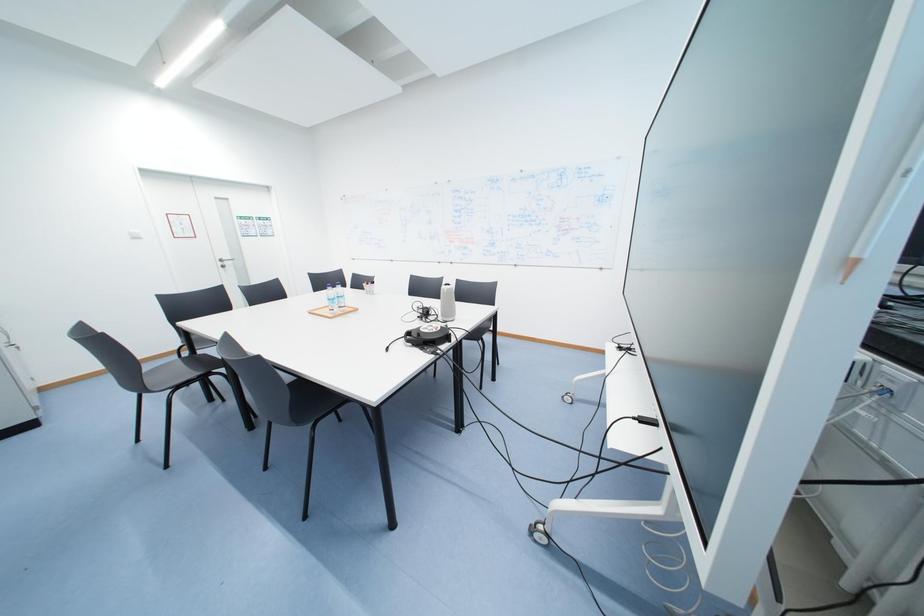
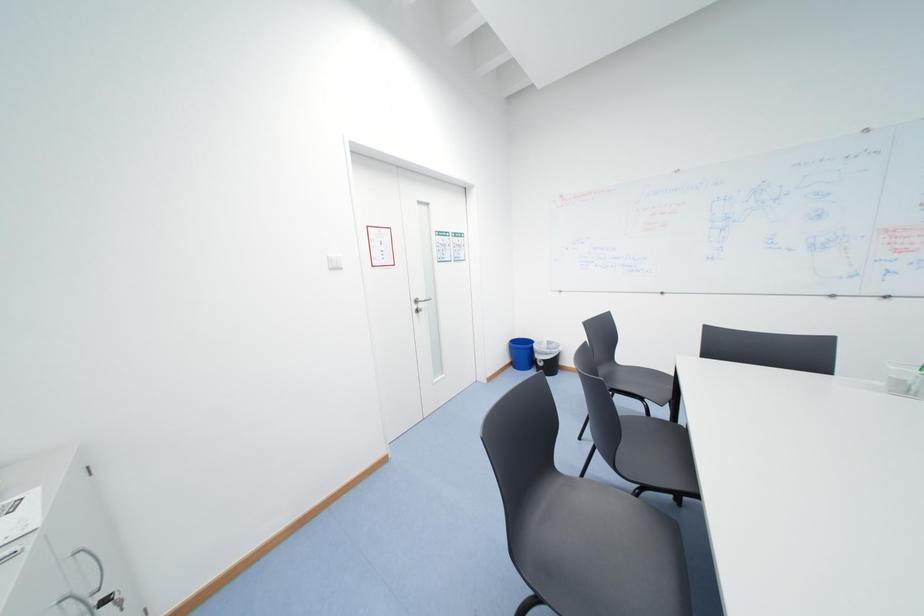
The images are taken continuously from a first-person perspective. In which direction are you moving?

The cameraman moved toward left, forward.